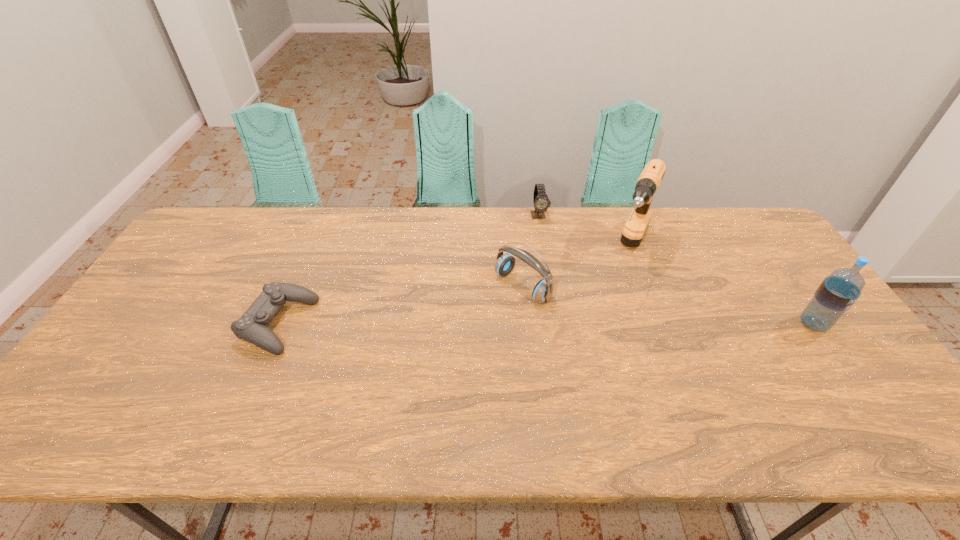
What are the coordinates of `vacant space situated 0.100m on the face of the watch` in the screenshot? It's located at (546, 242).

Image resolution: width=960 pixels, height=540 pixels. Identify the location of vacant space positioned 0.110m at the tip of the second object from right to left. (615, 300).

I want to click on free location located 0.280m at the tip of the second object from right to left, so click(x=597, y=341).

You are a GUI agent. You are given a task and a screenshot of the screen. Output one action in this format:
    pyautogui.click(x=<x>, y=<y>)
    Task: Click on the vacant space located at the tip of the second object from right to left
    This screenshot has height=540, width=960.
    Given the screenshot: What is the action you would take?
    pyautogui.click(x=602, y=330)

Identify the location of vacant space located 0.310m on the ear cups of the third tallest object. The width and height of the screenshot is (960, 540). (417, 364).

In order to click on blank space located on the ear cups of the third tallest object in this screenshot , I will do `click(468, 327)`.

You are a GUI agent. You are given a task and a screenshot of the screen. Output one action in this format:
    pyautogui.click(x=<x>, y=<y>)
    Task: Click on the vacant space situated on the ear cups of the third tallest object
    
    Given the screenshot: What is the action you would take?
    pyautogui.click(x=407, y=371)

Find the location of `watch present at the far edge`. watch present at the far edge is located at coordinates (541, 201).

The height and width of the screenshot is (540, 960). What are the coordinates of `drill located at the far edge` in the screenshot? It's located at (649, 180).

What are the coordinates of `object that is at the right edge` in the screenshot? It's located at (838, 292).